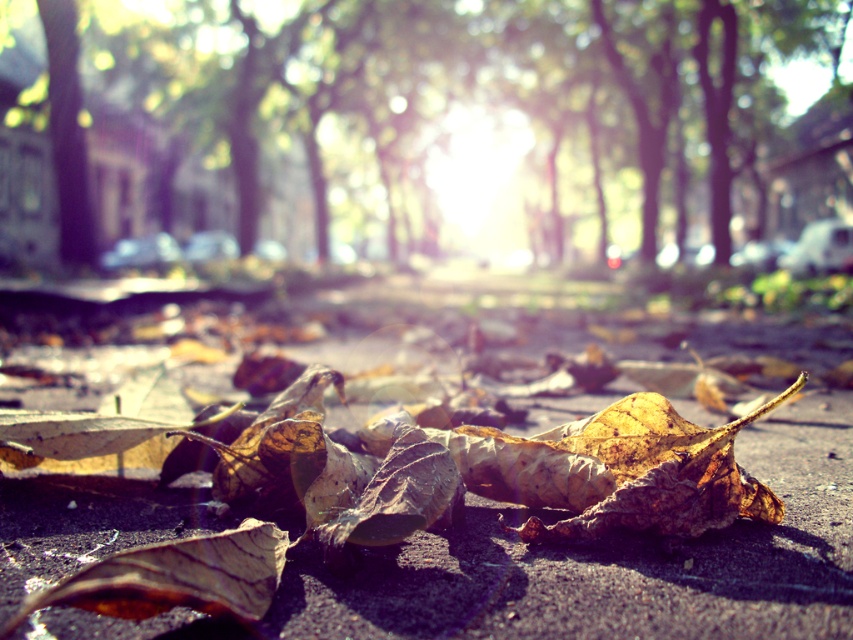
Who is taller, brown textured leaves at center or brown papery leaf at lower left?

With more height is brown papery leaf at lower left.

Between brown textured leaves at center and brown papery leaf at lower left, which one is positioned lower?

Positioned lower is brown papery leaf at lower left.

Is point (509, 401) in front of point (267, 582)?

No.

At what (x,y) coordinates should I click in order to perform the action: click on brown textured leaves at center. Please return your answer as a coordinate pair (x, y). Looking at the image, I should click on (607, 557).

The width and height of the screenshot is (853, 640). What do you see at coordinates (607, 557) in the screenshot?
I see `brown textured leaves at center` at bounding box center [607, 557].

Which is more to the left, brown textured leaves at center or brown/dry leaf at center?

brown/dry leaf at center

Which is behind, point (49, 561) or point (397, 435)?

Point (397, 435)

Identify the location of brown textured leaves at center. The width and height of the screenshot is (853, 640). (607, 557).

Between point (724, 429) and point (170, 593), which one is positioned in front?

Point (170, 593)

Does brown papery leaf at lower center appear under brown papery leaf at lower left?

No.

Does point (720, 492) come farther from viewer compared to point (86, 577)?

That is True.

You are a GUI agent. You are given a task and a screenshot of the screen. Output one action in this format:
    pyautogui.click(x=<x>, y=<y>)
    Task: Click on the brown papery leaf at lower center
    The image size is (853, 640).
    Given the screenshot: What is the action you would take?
    pyautogui.click(x=662, y=472)